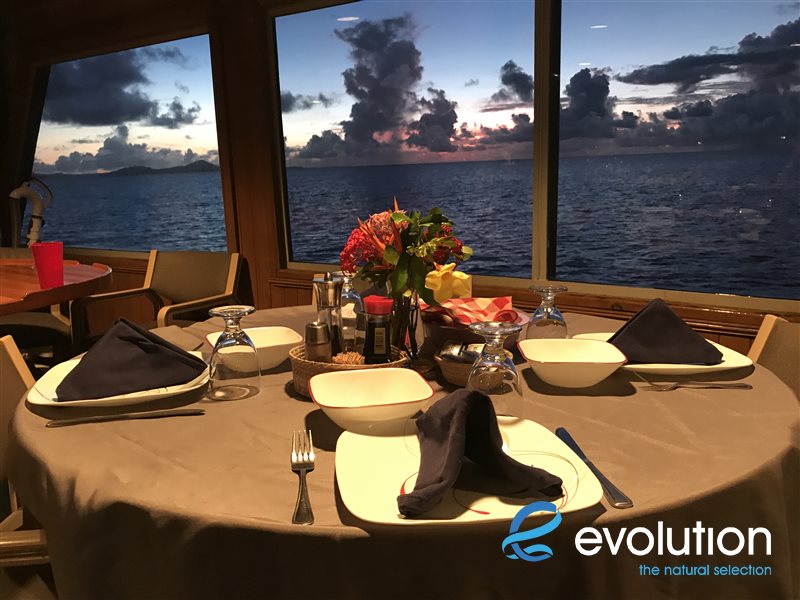
Where is `napkin`? This screenshot has height=600, width=800. napkin is located at coordinates (649, 325), (468, 399), (112, 344).